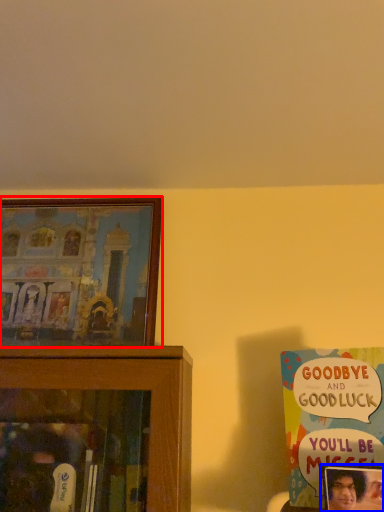
Question: Which of the following is the closest to the observer, picture frame (highlighted by a red box) or picture frame (highlighted by a blue box)?

Choices:
 (A) picture frame
 (B) picture frame

Answer: (B)